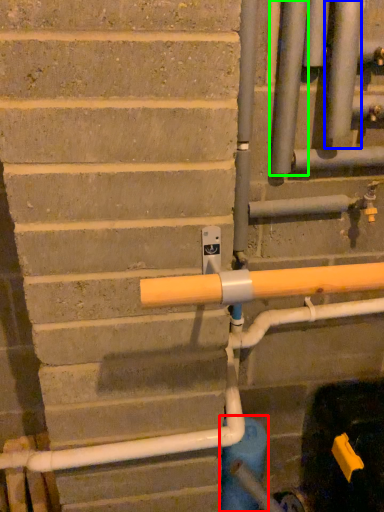
Question: Considering the real-world distances, which object is closest to water pipe (highlighted by a red box)? pipe (highlighted by a blue box) or pipe (highlighted by a green box).

Choices:
 (A) pipe
 (B) pipe

Answer: (B)